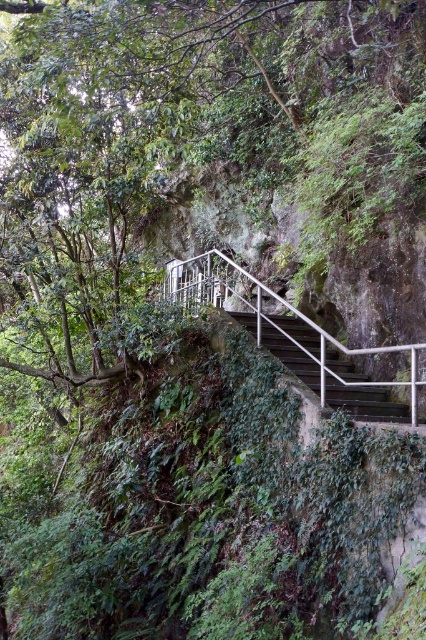
Question: Which object is the farthest from the metallic gray stairs at center?

Choices:
 (A) green leafy tree at upper left
 (B) metallic silver balustrade at center

Answer: (A)

Question: Does metallic silver balustrade at center appear on the right side of metallic gray stairs at center?

Choices:
 (A) yes
 (B) no

Answer: (B)

Question: Is the position of metallic silver balustrade at center more distant than that of metallic gray stairs at center?

Choices:
 (A) no
 (B) yes

Answer: (A)

Question: Can you confirm if metallic silver balustrade at center is positioned to the left of metallic gray stairs at center?

Choices:
 (A) no
 (B) yes

Answer: (B)

Question: Which point is closer to the camera?

Choices:
 (A) metallic silver balustrade at center
 (B) green leafy tree at upper left
 (C) metallic gray stairs at center

Answer: (A)

Question: Which of the following is the closest to the observer?

Choices:
 (A) green leafy tree at upper left
 (B) metallic gray stairs at center
 (C) metallic silver balustrade at center

Answer: (C)